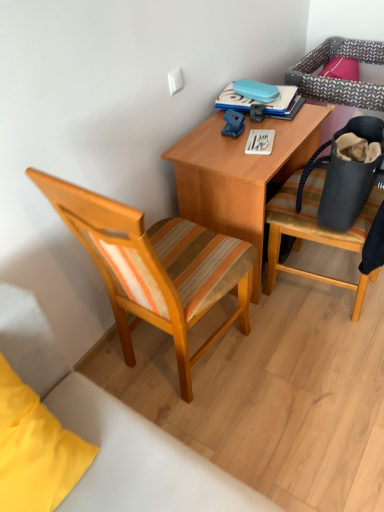
The height and width of the screenshot is (512, 384). What do you see at coordinates (35, 450) in the screenshot?
I see `white fabric pillow at lower left` at bounding box center [35, 450].

Image resolution: width=384 pixels, height=512 pixels. What are the coordinates of `white fabric pillow at lower left` in the screenshot? It's located at pos(35,450).

Based on the photo, measure the distance between point (252, 102) and camera.

Point (252, 102) and camera are 6.06 feet apart from each other.

You are a GUI agent. You are given a task and a screenshot of the screen. Output one action in this format:
    pyautogui.click(x=<x>, y=<y>)
    Task: Click on the blue plastic clip at center
    The height and width of the screenshot is (512, 384).
    Given the screenshot: What is the action you would take?
    pyautogui.click(x=233, y=123)

This screenshot has width=384, height=512. What are the coordinates of `wooden desk at center` in the screenshot? It's located at (240, 174).

Based on the photo, which of these two, wooden striped cushioned chair at right, the 2th chair viewed from the left, or blue plastic clip at center, is smaller?

blue plastic clip at center.

From the picture: Would you consider wooden striped cushioned chair at right, the 2th chair viewed from the left, to be distant from blue plastic clip at center?

No, wooden striped cushioned chair at right, the 2th chair viewed from the left, is not far from blue plastic clip at center.

Between wooden striped cushioned chair at right, the 2th chair viewed from the left, and blue plastic clip at center, which one has smaller width?

blue plastic clip at center is thinner.

From the image's perspective, is wooden striped cushioned chair at right, the 1th chair positioned from the right, located above or below blue plastic clip at center?

From the image's perspective, wooden striped cushioned chair at right, the 1th chair positioned from the right, appears below blue plastic clip at center.

From a real-world perspective, which is physically below, wooden striped cushioned chair at right, the 2th chair viewed from the left, or white fabric pillow at lower left?

wooden striped cushioned chair at right, the 2th chair viewed from the left, is physically lower.

Does wooden striped cushioned chair at right, the 2th chair viewed from the left, come behind white fabric pillow at lower left?

Yes, wooden striped cushioned chair at right, the 2th chair viewed from the left, is behind white fabric pillow at lower left.

Is wooden striped cushioned chair at right, the 1th chair positioned from the right, facing away from white fabric pillow at lower left?

No, white fabric pillow at lower left is not at the back of wooden striped cushioned chair at right, the 1th chair positioned from the right.

Consider the image. Which point is more forward, [0,480] or [331,170]?

The point [0,480] is closer.

From the picture: Is white fabric pillow at lower left touching matte black bag at right?

No, white fabric pillow at lower left is not beside matte black bag at right.

Is white fabric pillow at lower left facing towards matte black bag at right?

No, white fabric pillow at lower left is not oriented towards matte black bag at right.

Between woodenchair at left, the first chair positioned from the left, and wooden striped cushioned chair at right, the 2th chair viewed from the left, which one is positioned behind?

wooden striped cushioned chair at right, the 2th chair viewed from the left, is behind.

From a real-world perspective, is woodenchair at left, which is counted as the second chair, starting from the right, beneath wooden striped cushioned chair at right, the 1th chair positioned from the right?

No, from a real-world perspective, woodenchair at left, which is counted as the second chair, starting from the right, is not under wooden striped cushioned chair at right, the 1th chair positioned from the right.

Is woodenchair at left, which is counted as the second chair, starting from the right, spatially inside wooden striped cushioned chair at right, the 1th chair positioned from the right, or outside of it?

woodenchair at left, which is counted as the second chair, starting from the right, is not enclosed by wooden striped cushioned chair at right, the 1th chair positioned from the right.

Who is more distant, blue plastic clip at center or wooden striped cushioned chair at right, the 1th chair positioned from the right?

blue plastic clip at center is more distant.

Is blue plastic clip at center positioned far away from wooden striped cushioned chair at right, the 1th chair positioned from the right?

That's not correct — blue plastic clip at center is a little close to wooden striped cushioned chair at right, the 1th chair positioned from the right.

Based on their positions, is blue plastic clip at center located to the left or right of wooden striped cushioned chair at right, the 2th chair viewed from the left?

blue plastic clip at center is to the left of wooden striped cushioned chair at right, the 2th chair viewed from the left.

From a real-world perspective, is blue plastic clip at center beneath wooden striped cushioned chair at right, the 2th chair viewed from the left?

No, from a real-world perspective, blue plastic clip at center is not under wooden striped cushioned chair at right, the 2th chair viewed from the left.

Can you confirm if woodenchair at left, which is counted as the second chair, starting from the right, is taller than blue plastic clip at center?

Yes.

Which is in front, point (111, 281) or point (235, 120)?

The point (111, 281) is more forward.

You are a GUI agent. You are given a task and a screenshot of the screen. Output one action in this format:
    pyautogui.click(x=<x>, y=<y>)
    Task: Click on the toy behind the woodenchair at left, the first chair positioned from the left
    The height and width of the screenshot is (512, 384).
    Given the screenshot: What is the action you would take?
    pyautogui.click(x=233, y=123)

Based on the photo, which object is thinner, woodenchair at left, the first chair positioned from the left, or blue plastic clip at center?

With smaller width is blue plastic clip at center.

Is blue hardcover book at upper center positioned behind wooden striped cushioned chair at right, the 1th chair positioned from the right?

Yes, the depth of blue hardcover book at upper center is greater than that of wooden striped cushioned chair at right, the 1th chair positioned from the right.

At what (x,y) coordinates should I click in order to perform the action: click on book behind the wooden striped cushioned chair at right, the 1th chair positioned from the right. Please return your answer as a coordinate pair (x, y). This screenshot has height=512, width=384. Looking at the image, I should click on (256, 100).

Based on the photo, does blue hardcover book at upper center have a smaller size compared to wooden striped cushioned chair at right, the 2th chair viewed from the left?

Yes, blue hardcover book at upper center is smaller than wooden striped cushioned chair at right, the 2th chair viewed from the left.

Find the location of `toy that appears above the wooden striped cushioned chair at right, the 2th chair viewed from the left (from the image's perspective)`. toy that appears above the wooden striped cushioned chair at right, the 2th chair viewed from the left (from the image's perspective) is located at coordinates (233, 123).

Find the location of `pillow on the left of wooden striped cushioned chair at right, the 2th chair viewed from the left`. pillow on the left of wooden striped cushioned chair at right, the 2th chair viewed from the left is located at coordinates (35, 450).

Considering their positions, is blue hardcover book at upper center positioned further to wooden desk at center than white fabric pillow at lower left?

white fabric pillow at lower left is positioned further to the anchor wooden desk at center.

Considering their positions, is white fabric pillow at lower left positioned closer to blue hardcover book at upper center than wooden striped cushioned chair at right, the 2th chair viewed from the left?

Among the two, wooden striped cushioned chair at right, the 2th chair viewed from the left, is located nearer to blue hardcover book at upper center.

Which object lies nearer to the anchor point woodenchair at left, which is counted as the second chair, starting from the right, wooden desk at center or white fabric pillow at lower left?

wooden desk at center.

Based on their spatial positions, is wooden desk at center or woodenchair at left, which is counted as the second chair, starting from the right, closer to white fabric pillow at lower left?

woodenchair at left, which is counted as the second chair, starting from the right, is positioned closer to the anchor white fabric pillow at lower left.

Estimate the real-world distances between objects in this image. Which object is closer to matte black bag at right, woodenchair at left, which is counted as the second chair, starting from the right, or blue plastic clip at center?

blue plastic clip at center lies closer to matte black bag at right than the other object.

Which object lies further to the anchor point white fabric pillow at lower left, blue plastic clip at center or wooden desk at center?

blue plastic clip at center lies further to white fabric pillow at lower left than the other object.

Considering their positions, is blue plastic clip at center positioned closer to blue hardcover book at upper center than woodenchair at left, which is counted as the second chair, starting from the right?

The object closer to blue hardcover book at upper center is blue plastic clip at center.

Which object lies further to the anchor point wooden desk at center, matte black bag at right or woodenchair at left, the first chair positioned from the left?

Based on the image, woodenchair at left, the first chair positioned from the left, appears to be further to wooden desk at center.

The width and height of the screenshot is (384, 512). Find the location of `desk between woodenchair at left, the first chair positioned from the left, and blue hardcover book at upper center in the front-back direction`. desk between woodenchair at left, the first chair positioned from the left, and blue hardcover book at upper center in the front-back direction is located at coordinates (240, 174).

The image size is (384, 512). What are the coordinates of `chair between woodenchair at left, which is counted as the second chair, starting from the right, and blue plastic clip at center from front to back` in the screenshot? It's located at (316, 231).

Where is `desk between blue hardcover book at upper center and white fabric pillow at lower left in the up-down direction`? desk between blue hardcover book at upper center and white fabric pillow at lower left in the up-down direction is located at coordinates (240, 174).

Identify the location of toy between wooden striped cushioned chair at right, the 1th chair positioned from the right, and blue hardcover book at upper center in the front-back direction. The image size is (384, 512). (233, 123).